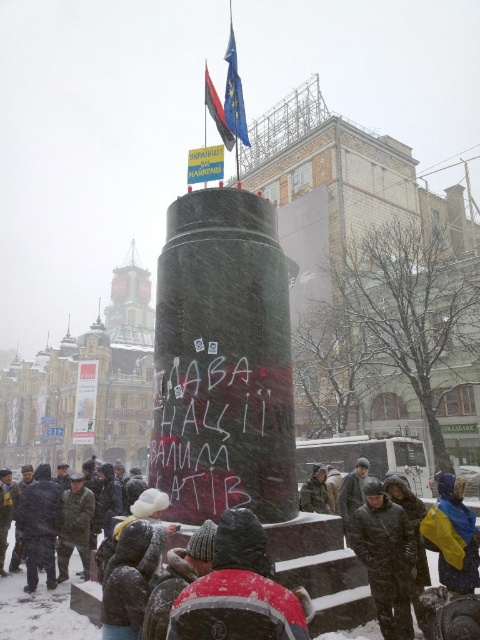
You are a photographer trying to capture both the dark brown leather jacket at center and the camouflage fabric jacket at center in a single frame. Since both jackets are at the center, which one should you position your camera to the left of to ensure both are in the frame?

The dark brown leather jacket at center is to the right of the camouflage fabric jacket at center. To include both in the frame, position your camera to the left of the dark brown leather jacket at center so that the camouflage fabric jacket at center is on the left side and the dark brown leather jacket at center is on the right side of the frame.